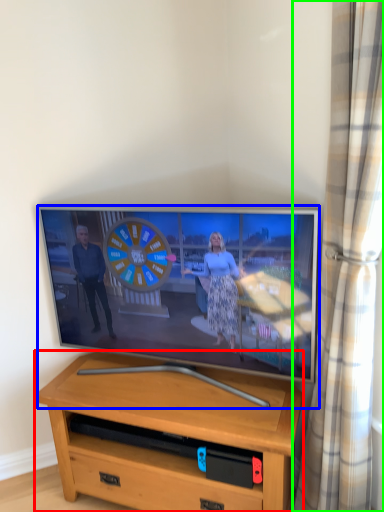
Question: Which object is positioned closest to desk (highlighted by a red box)? Select from television (highlighted by a blue box) and curtain (highlighted by a green box).

Choices:
 (A) television
 (B) curtain

Answer: (A)